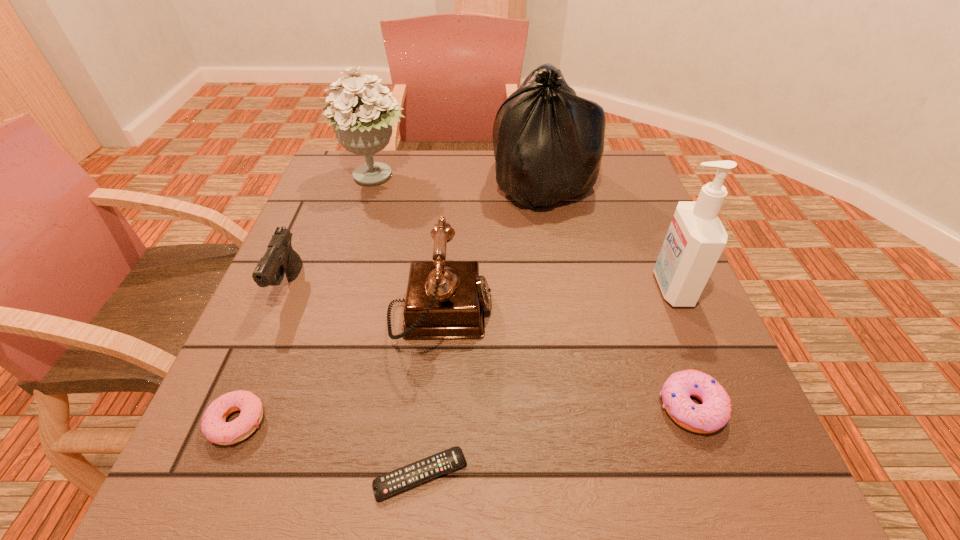
Find the location of `vacant space located on the front of the plastic bag`. vacant space located on the front of the plastic bag is located at coordinates 557,266.

Where is `vacant space located on the front of the bouquet`? The image size is (960, 540). vacant space located on the front of the bouquet is located at coordinates (338, 303).

You are a GUI agent. You are given a task and a screenshot of the screen. Output one action in this format:
    pyautogui.click(x=<x>, y=<y>)
    Task: Click on the free space located 0.140m on the front label of the cleansing agent
    
    Given the screenshot: What is the action you would take?
    pyautogui.click(x=588, y=288)

Identify the location of vacant space located 0.150m on the front label of the cleansing agent. click(583, 288).

I want to click on free region located on the front label of the cleansing agent, so point(579,288).

Locate an element on the screen. The width and height of the screenshot is (960, 540). free space located 0.350m on the dial of the fifth shortest object is located at coordinates [665, 315].

At what (x,y) coordinates should I click in order to perform the action: click on free region located at the barrel of the fifth tallest object. Please return your answer as a coordinate pair (x, y). The height and width of the screenshot is (540, 960). Looking at the image, I should click on (250, 379).

Image resolution: width=960 pixels, height=540 pixels. I want to click on vacant region located 0.060m on the back of the right doughnut, so coord(671,351).

At what (x,y) coordinates should I click in order to perform the action: click on vacant area situated on the right of the shorter doughnut. Please return your answer as a coordinate pair (x, y). The image size is (960, 540). Looking at the image, I should click on (320, 422).

The image size is (960, 540). I want to click on free region located on the right of the shortest object, so click(618, 475).